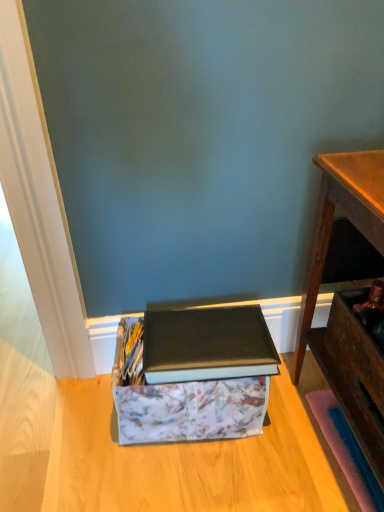
Image resolution: width=384 pixels, height=512 pixels. What are the coordinates of `free space above matte black book at center (from a real-world perspective)` in the screenshot? It's located at (207, 346).